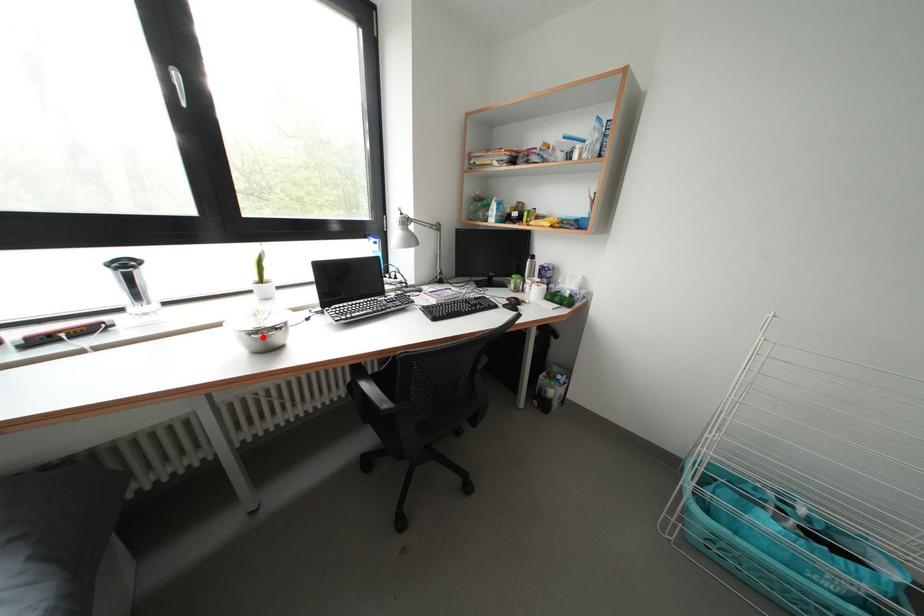
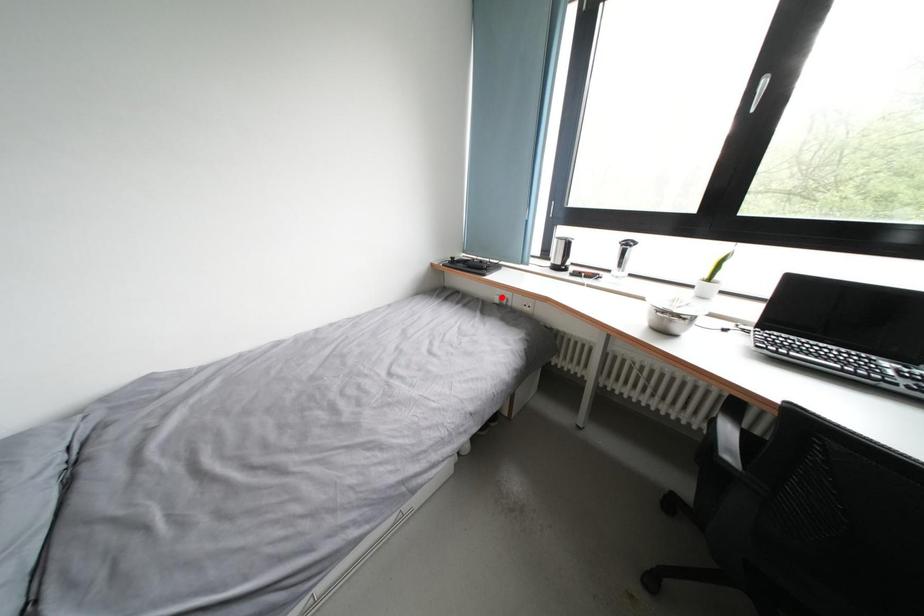
I am providing you with two images of the same scene from different viewpoints. A red point is marked on the first image and another point is marked on the second image. Does the point marked in image1 correspond to the same location as the one in image2?

No